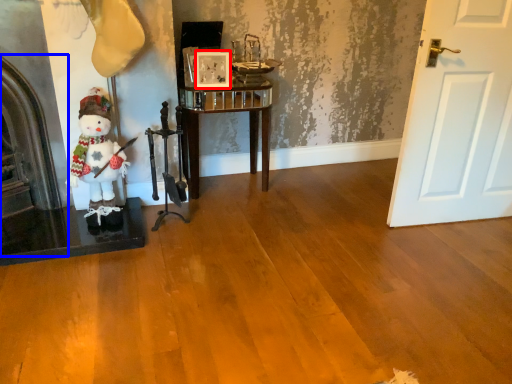
Question: Which object is further to the camera taking this photo, picture frame (highlighted by a red box) or fireplace (highlighted by a blue box)?

Choices:
 (A) picture frame
 (B) fireplace

Answer: (A)